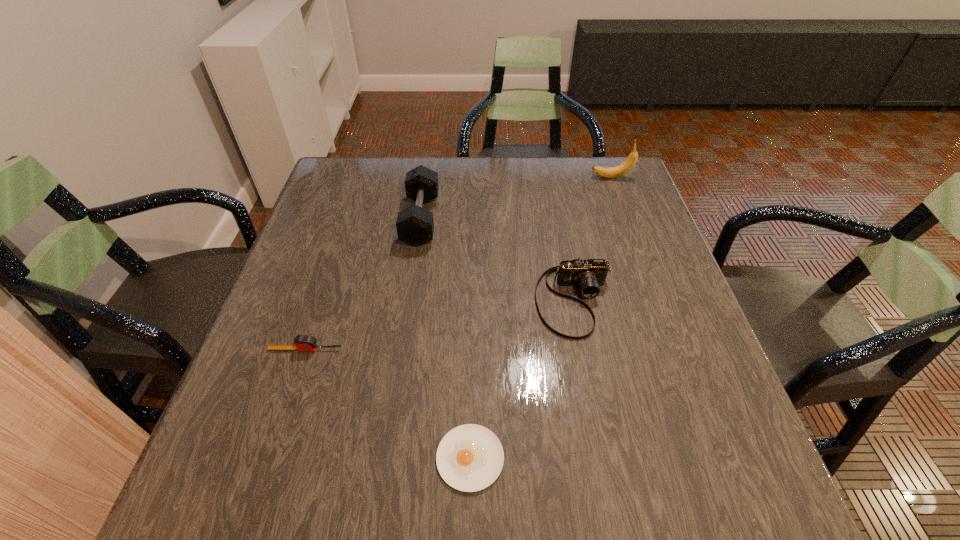
The height and width of the screenshot is (540, 960). I want to click on object present at the left edge, so click(x=302, y=342).

The height and width of the screenshot is (540, 960). I want to click on banana positioned at the right edge, so click(607, 172).

I want to click on camera that is at the right edge, so click(x=589, y=274).

Where is `object that is positioned at the far right corner`? The height and width of the screenshot is (540, 960). object that is positioned at the far right corner is located at coordinates (607, 172).

Locate an element on the screen. free space at the far edge of the desktop is located at coordinates (539, 196).

This screenshot has width=960, height=540. Find the location of `vacant space at the near edge of the desktop`. vacant space at the near edge of the desktop is located at coordinates click(430, 516).

Identify the location of vacant point at the left edge. (311, 219).

This screenshot has height=540, width=960. I want to click on blank space at the right edge, so click(632, 328).

In the image, there is a desktop. What are the coordinates of `vacant space at the far left corner` in the screenshot? It's located at (369, 172).

The height and width of the screenshot is (540, 960). Find the location of `vacant space at the far right corner`. vacant space at the far right corner is located at coordinates (624, 161).